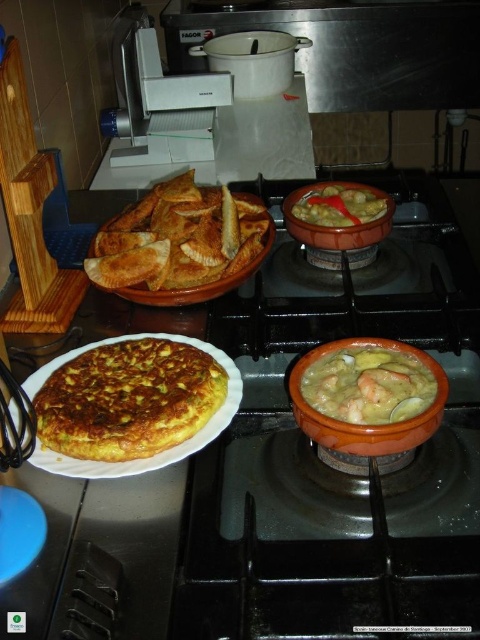
You are a chef preparing dishes for a customer. You have a yellow omelette at center and a golden brown crispy pastry at center on your stove. Which dish is taller?

The golden brown crispy pastry at center is taller than the yellow omelette at center.

You are standing in the kitchen and need to reach the black matte gas stove at center. Which direction should you move relative to your current position?

The black matte gas stove at center is located at point coordinates, so you should move towards the center of the kitchen to reach it.